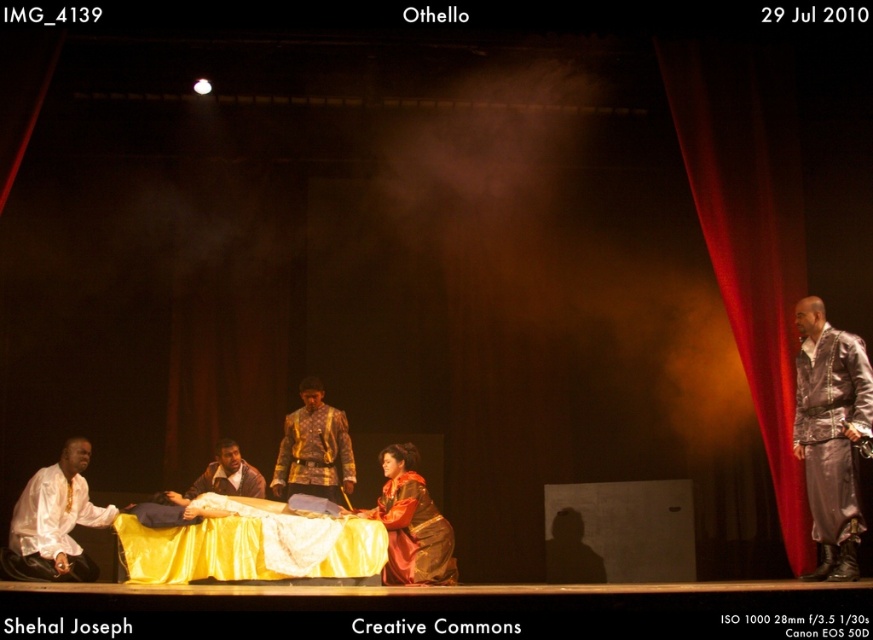
Is gold textured jacket at center below brown leather jacket at center?

Actually, gold textured jacket at center is above brown leather jacket at center.

Is gold textured jacket at center closer to camera compared to brown leather jacket at center?

No, it is not.

Locate an element on the screen. gold textured jacket at center is located at coordinates (314, 449).

Can you confirm if white satin shirt at lower left is positioned below brown leather jacket at center?

Yes, white satin shirt at lower left is below brown leather jacket at center.

Which is in front, point (28, 499) or point (252, 465)?

Point (28, 499) is more forward.

Identify the location of white satin shirt at lower left. The width and height of the screenshot is (873, 640). (53, 522).

Is velvet red dress at center taller than brown leather jacket at center?

Indeed, velvet red dress at center has a greater height compared to brown leather jacket at center.

Does velvet red dress at center have a larger size compared to brown leather jacket at center?

Indeed, velvet red dress at center has a larger size compared to brown leather jacket at center.

In order to click on velvet red dress at center in this screenshot , I will do `click(411, 524)`.